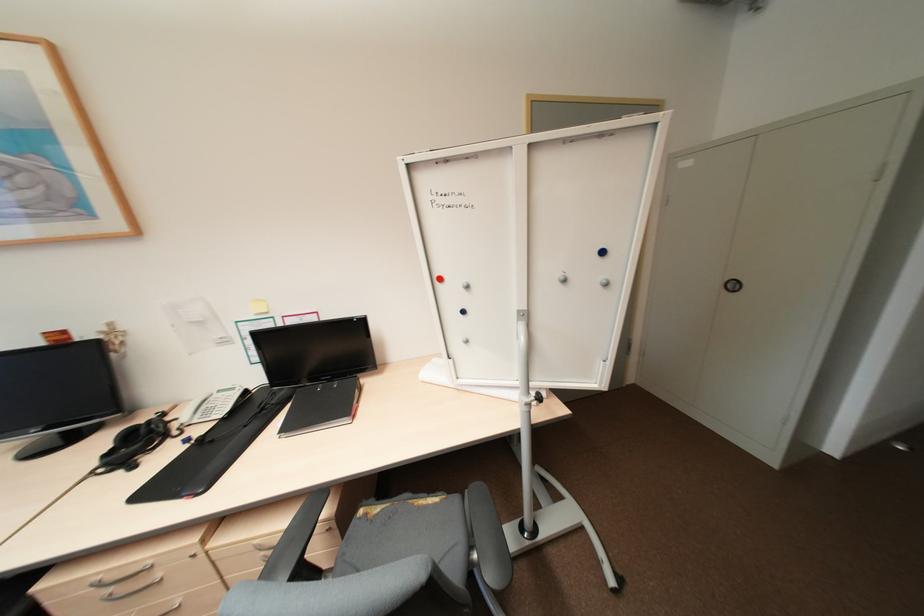
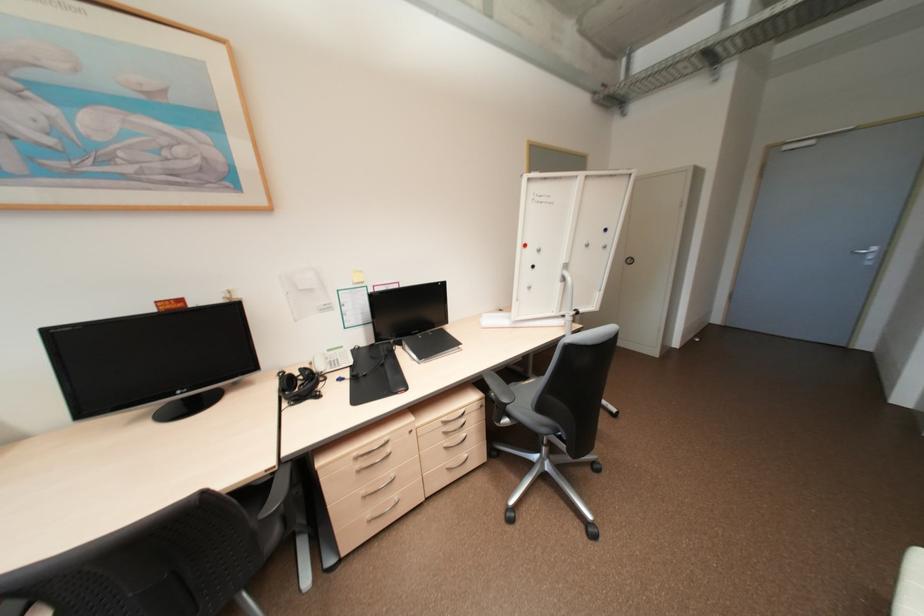
Locate, in the second image, the point that corresponds to (x=446, y=278) in the first image.

(530, 245)